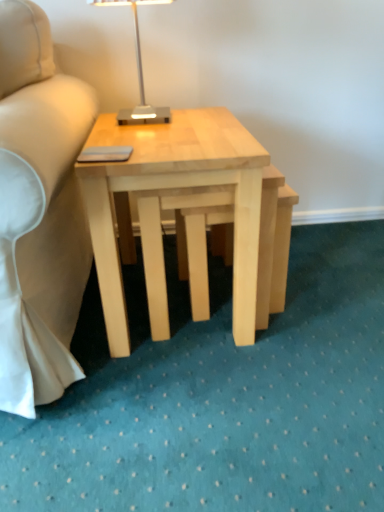
This screenshot has width=384, height=512. Describe the element at coordinates (203, 250) in the screenshot. I see `natural wood step stool at center` at that location.

The height and width of the screenshot is (512, 384). What do you see at coordinates (138, 72) in the screenshot? I see `metallic silver table lamp at upper center` at bounding box center [138, 72].

What do you see at coordinates (176, 188) in the screenshot? This screenshot has height=512, width=384. I see `natural wood coffee table at center` at bounding box center [176, 188].

Identify the location of natural wood step stool at center. Image resolution: width=384 pixels, height=512 pixels. (203, 250).

Is natural wood coffee table at center taller or shorter than metallic silver table lamp at upper center?

Clearly, natural wood coffee table at center is taller compared to metallic silver table lamp at upper center.

Is natural wood coffee table at center in front of metallic silver table lamp at upper center?

Yes, it is in front of metallic silver table lamp at upper center.

Is natural wood coffee table at center facing away from metallic silver table lamp at upper center?

No.

Can you confirm if natural wood coffee table at center is bigger than metallic silver table lamp at upper center?

Indeed, natural wood coffee table at center has a larger size compared to metallic silver table lamp at upper center.

Is metallic silver table lamp at upper center oriented away from natural wood coffee table at center?

metallic silver table lamp at upper center does not have its back to natural wood coffee table at center.

From a real-world perspective, between metallic silver table lamp at upper center and natural wood coffee table at center, who is vertically lower?

In real-world perspective, natural wood coffee table at center is lower.

Does metallic silver table lamp at upper center have a lesser height compared to natural wood coffee table at center?

Correct, metallic silver table lamp at upper center is not as tall as natural wood coffee table at center.

Between natural wood step stool at center and natural wood coffee table at center, which one is positioned in front?

natural wood coffee table at center is more forward.

From a real-world perspective, relative to natural wood coffee table at center, is natural wood step stool at center vertically above or below?

natural wood step stool at center is below natural wood coffee table at center.

Is natural wood step stool at center thinner than natural wood coffee table at center?

Yes, natural wood step stool at center is thinner than natural wood coffee table at center.

Would you consider natural wood coffee table at center to be distant from natural wood step stool at center?

No, natural wood coffee table at center is in close proximity to natural wood step stool at center.

Is natural wood coffee table at center surrounding natural wood step stool at center?

Yes.

From the image's perspective, is natural wood coffee table at center on top of natural wood step stool at center?

Yes.

Where is `coffee table above the natural wood step stool at center (from a real-world perspective)`? This screenshot has width=384, height=512. coffee table above the natural wood step stool at center (from a real-world perspective) is located at coordinates (176, 188).

From the image's perspective, between natural wood step stool at center and metallic silver table lamp at upper center, which one is located above?

metallic silver table lamp at upper center appears higher in the image.

Considering the sizes of objects natural wood step stool at center and metallic silver table lamp at upper center in the image provided, who is bigger, natural wood step stool at center or metallic silver table lamp at upper center?

natural wood step stool at center.

From the picture: From a real-world perspective, is natural wood step stool at center positioned under metallic silver table lamp at upper center based on gravity?

Yes.

Is the depth of metallic silver table lamp at upper center less than that of natural wood step stool at center?

Yes.

You are a GUI agent. You are given a task and a screenshot of the screen. Output one action in this format:
    pyautogui.click(x=<x>, y=<y>)
    Task: Click on the table lamp above the natural wood step stool at center (from the image's perspective)
    This screenshot has width=384, height=512.
    Given the screenshot: What is the action you would take?
    pyautogui.click(x=138, y=72)

From a real-world perspective, between metallic silver table lamp at upper center and natural wood step stool at center, who is vertically higher?

In real-world perspective, metallic silver table lamp at upper center is above.

The height and width of the screenshot is (512, 384). Identify the location of coffee table in front of the metallic silver table lamp at upper center. (176, 188).

Find the location of a particular element. The image size is (384, 512). coffee table on the right side of metallic silver table lamp at upper center is located at coordinates (176, 188).

Estimate the real-world distances between objects in this image. Which object is further from natural wood coffee table at center, metallic silver table lamp at upper center or natural wood step stool at center?

The object further to natural wood coffee table at center is metallic silver table lamp at upper center.

Consider the image. From the image, which object appears to be nearer to metallic silver table lamp at upper center, natural wood coffee table at center or natural wood step stool at center?

natural wood coffee table at center is closer to metallic silver table lamp at upper center.

Considering their positions, is natural wood coffee table at center positioned further to natural wood step stool at center than metallic silver table lamp at upper center?

Among the two, metallic silver table lamp at upper center is located further to natural wood step stool at center.

Based on their spatial positions, is natural wood step stool at center or natural wood coffee table at center closer to metallic silver table lamp at upper center?

Based on the image, natural wood coffee table at center appears to be nearer to metallic silver table lamp at upper center.

Which object lies nearer to the anchor point natural wood step stool at center, metallic silver table lamp at upper center or natural wood coffee table at center?

natural wood coffee table at center is positioned closer to the anchor natural wood step stool at center.

From the image, which object appears to be farther from natural wood coffee table at center, natural wood step stool at center or metallic silver table lamp at upper center?

metallic silver table lamp at upper center is positioned further to the anchor natural wood coffee table at center.

At what (x,y) coordinates should I click in order to perform the action: click on coffee table between metallic silver table lamp at upper center and natural wood step stool at center in the vertical direction. Please return your answer as a coordinate pair (x, y). The height and width of the screenshot is (512, 384). Looking at the image, I should click on (176, 188).